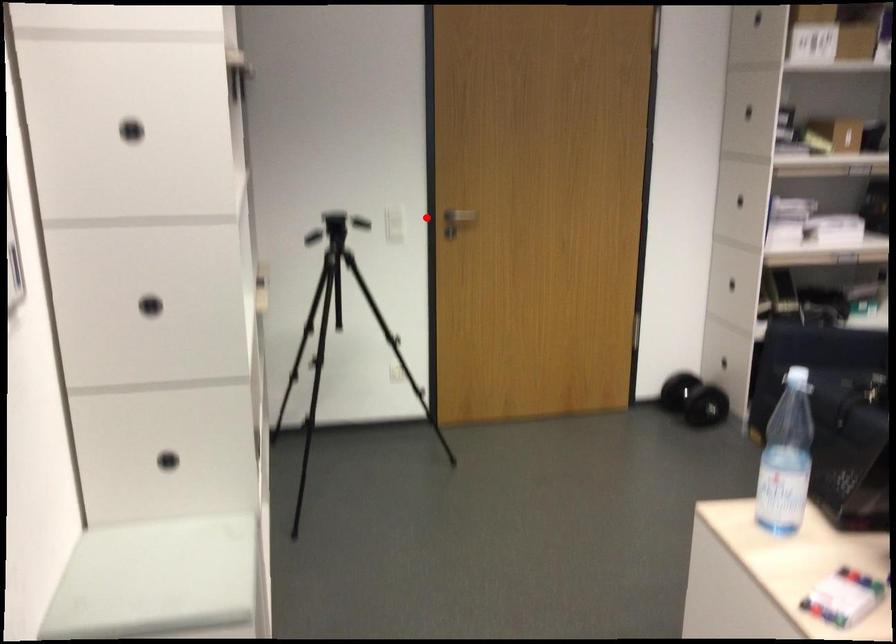
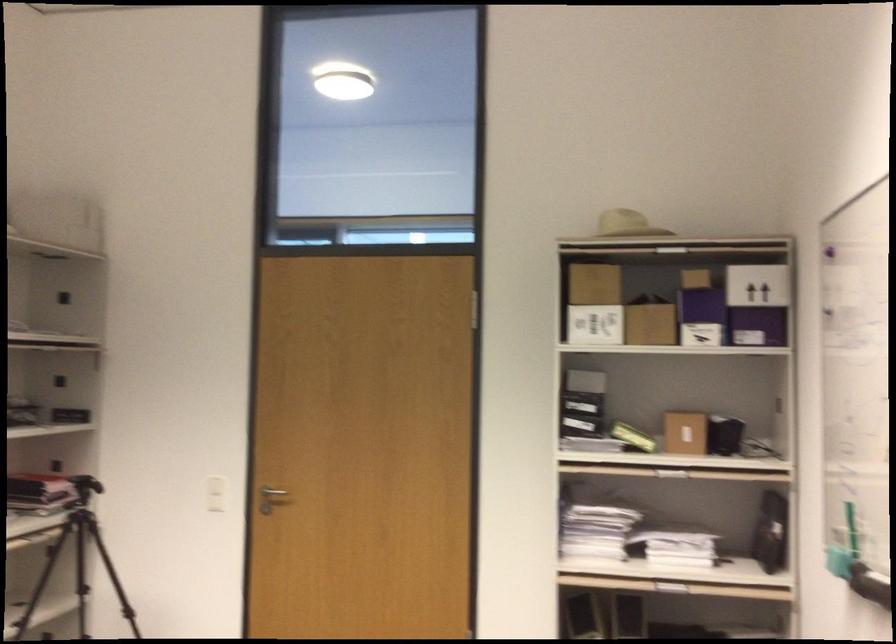
Where in the second image is the point corresponding to the highlighted location from the first image?

(272, 491)